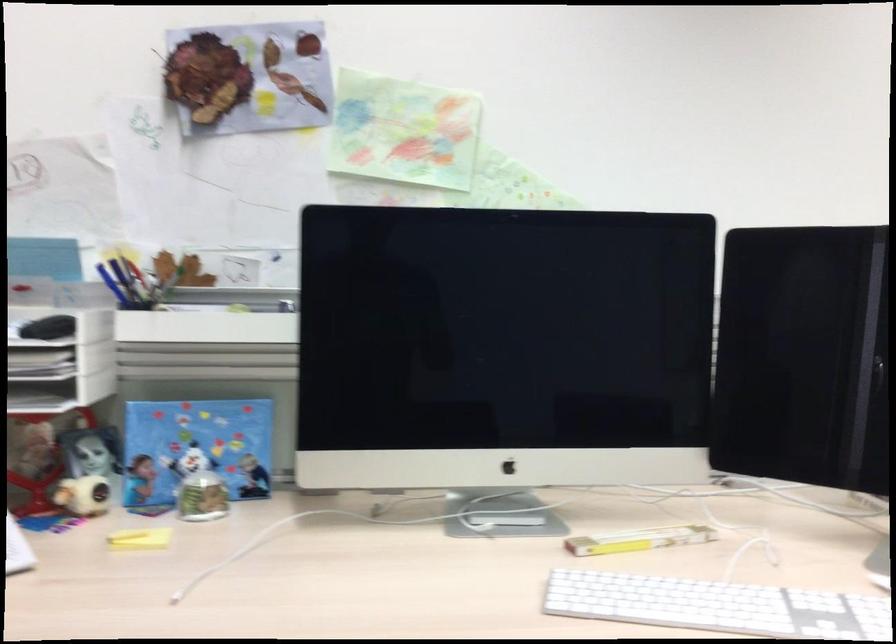
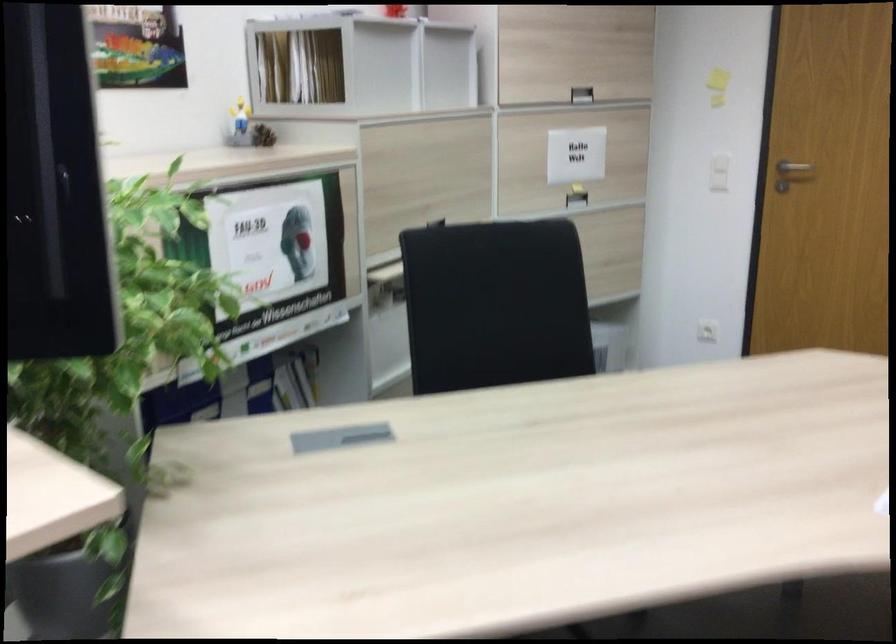
The first image is from the beginning of the video and the second image is from the end. How did the camera likely rotate when shooting the video?

The camera rotated toward right-down.